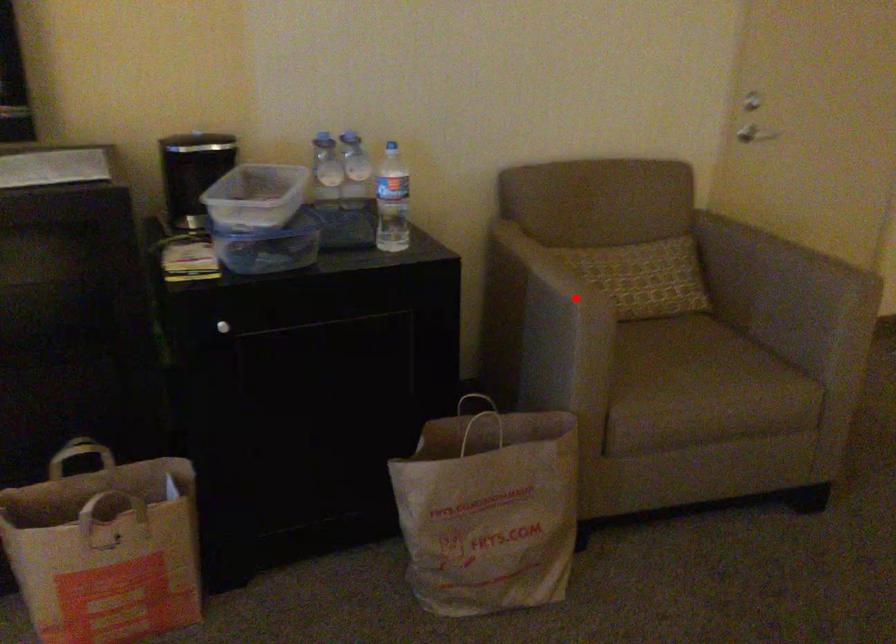
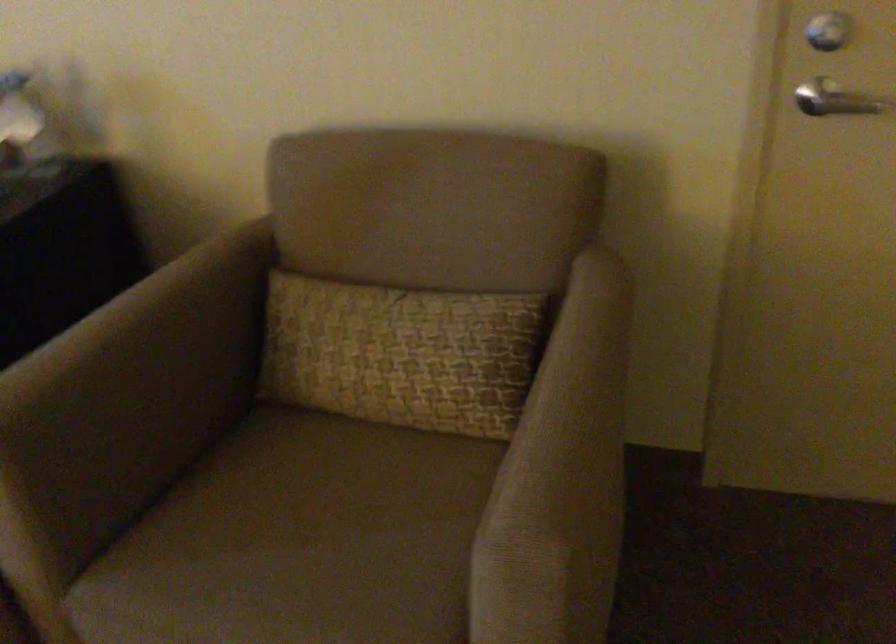
Question: I am providing you with two images of the same scene from different viewpoints. Image1 has a red point marked. In image2, the corresponding 3D location appears at what relative position? Reply with the corresponding letter.

Choices:
 (A) Closer
 (B) Farther

Answer: (A)